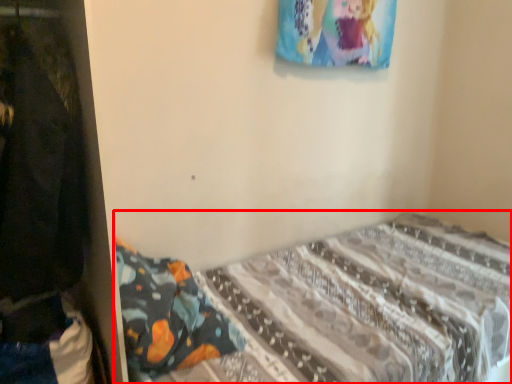
Question: From the image's perspective, considering the relative positions of bed (annotated by the red box) and closet in the image provided, where is bed (annotated by the red box) located with respect to the staircase?

Choices:
 (A) below
 (B) above

Answer: (A)